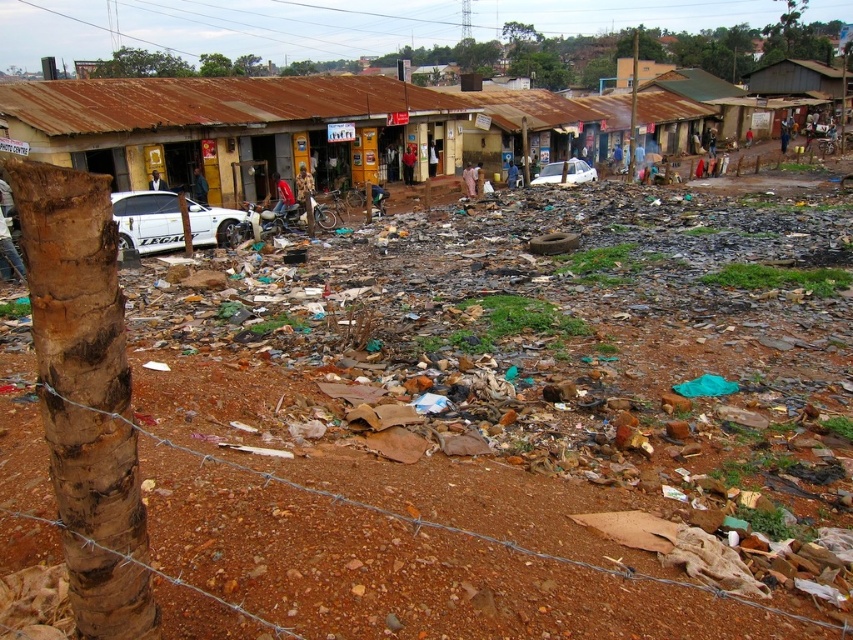
You are a delivery driver trying to navigate through the urban decay scene. You need to deliver a package to the barbed wire fence running horizontally across the frame. Your current position is at point (148, 220). Is the white matte car at left in front of or behind the barbed wire fence running horizontally across the frame?

The white matte car at left is located at point (148, 220), which is your current position. Since the barbed wire fence is in the foreground, the white matte car at left is behind the barbed wire fence running horizontally across the frame.